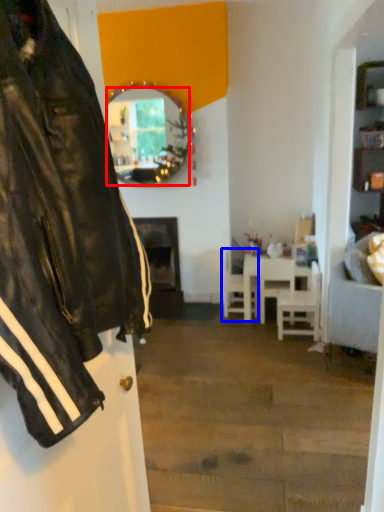
Question: Which of the following is the farthest to the observer, mirror (highlighted by a red box) or chair (highlighted by a blue box)?

Choices:
 (A) mirror
 (B) chair

Answer: (B)